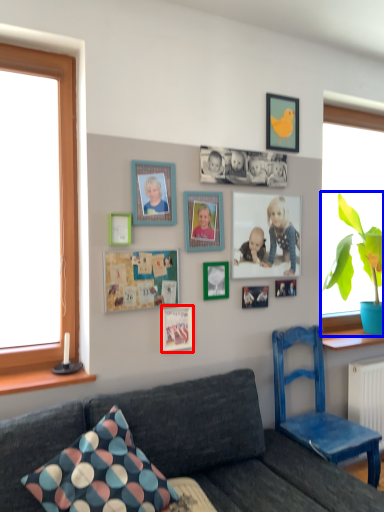
Question: Which object is further to the camera taking this photo, picture frame (highlighted by a red box) or houseplant (highlighted by a blue box)?

Choices:
 (A) picture frame
 (B) houseplant

Answer: (B)